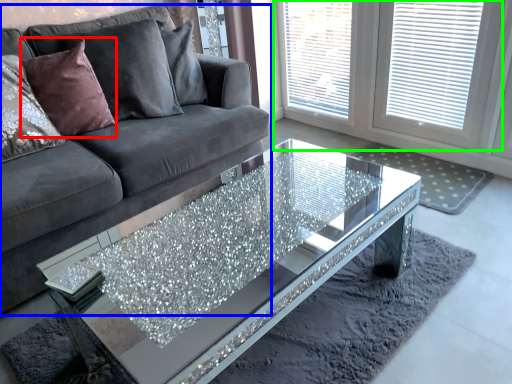
Question: Which is farther away from pillow (highlighted by a red box)? studio couch (highlighted by a blue box) or window (highlighted by a green box)?

Choices:
 (A) studio couch
 (B) window

Answer: (B)